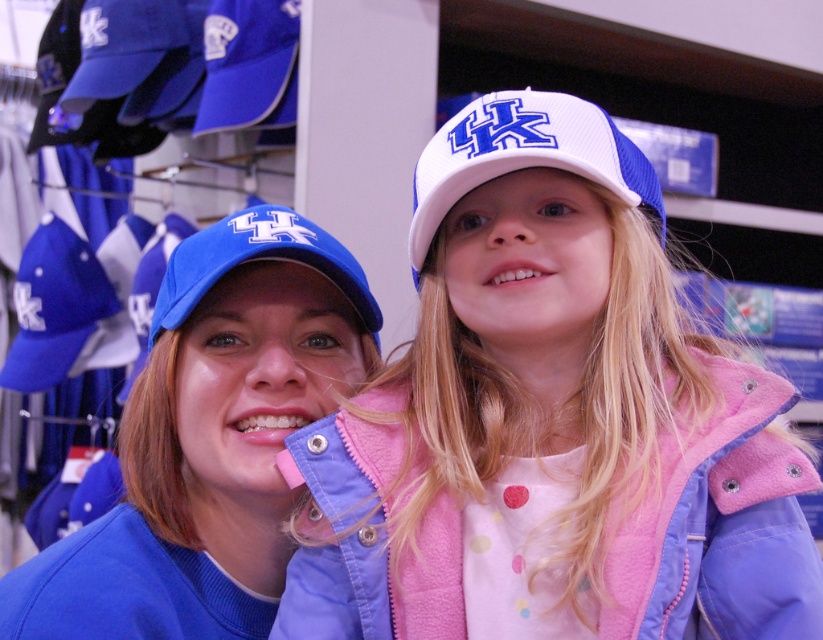
Does white mesh baseball cap at upper center appear on the left side of matte blue baseball cap at center?

No, white mesh baseball cap at upper center is not to the left of matte blue baseball cap at center.

What do you see at coordinates (524, 156) in the screenshot? The image size is (823, 640). I see `white mesh baseball cap at upper center` at bounding box center [524, 156].

Image resolution: width=823 pixels, height=640 pixels. What do you see at coordinates (524, 156) in the screenshot?
I see `white mesh baseball cap at upper center` at bounding box center [524, 156].

Where is `white mesh baseball cap at upper center`? white mesh baseball cap at upper center is located at coordinates (524, 156).

Does matte blue cap at center appear on the right side of white mesh baseball cap at upper center?

No, matte blue cap at center is not to the right of white mesh baseball cap at upper center.

Is matte blue cap at center to the left of white mesh baseball cap at upper center from the viewer's perspective?

Indeed, matte blue cap at center is positioned on the left side of white mesh baseball cap at upper center.

Where is `matte blue cap at center`? This screenshot has height=640, width=823. matte blue cap at center is located at coordinates (210, 440).

Does white mesh cap at center have a lesser width compared to white mesh baseball cap at upper center?

Incorrect, white mesh cap at center's width is not less than white mesh baseball cap at upper center's.

Can you confirm if white mesh cap at center is bigger than white mesh baseball cap at upper center?

Indeed, white mesh cap at center has a larger size compared to white mesh baseball cap at upper center.

The height and width of the screenshot is (640, 823). In order to click on white mesh cap at center in this screenshot , I will do `click(549, 420)`.

Find the location of a particular element. Image resolution: width=823 pixels, height=640 pixels. white mesh cap at center is located at coordinates (549, 420).